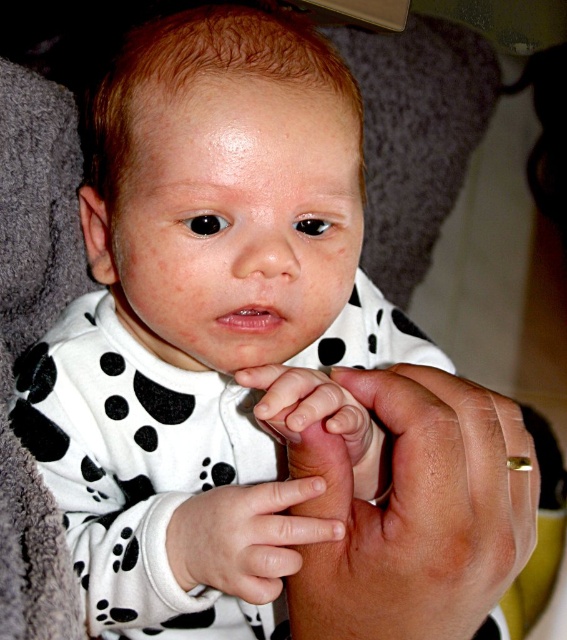
Does smooth skin hand at center appear over white smooth skin at center?

Correct, smooth skin hand at center is located above white smooth skin at center.

Is smooth skin hand at center wider than white smooth skin at center?

Indeed, smooth skin hand at center has a greater width compared to white smooth skin at center.

Is point (484, 401) positioned before point (306, 481)?

That is False.

Find the location of a particular element. smooth skin hand at center is located at coordinates coord(416,513).